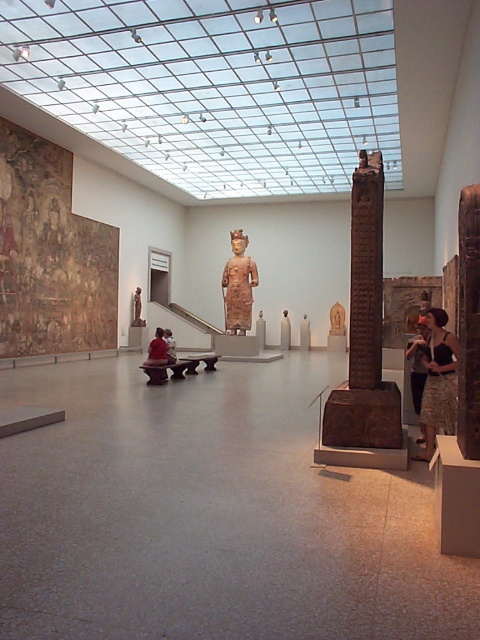
You are an art student visiting the museum and want to take a photo of the brown stone pillar at center without any obstructions. However, there is a black textured skirt at lower right in the way. Can you move around the pillar to get an unobstructed view?

The black textured skirt at lower right is behind the brown stone pillar at center, so if you move around to the front side of the brown stone pillar at center, you can take a photo without the skirt obstructing the view.

You are a tour guide leading a group through the museum. You want to ensure that visitors can comfortably walk between the brown stone pillar at center and the matte black statue at center. The average person requires 70 centimeters of space to move comfortably. Is the space between them sufficient?

The distance between the brown stone pillar at center and the matte black statue at center is 88.88 centimeters, which is more than the required 70 centimeters. Therefore, the space is sufficient for visitors to move comfortably between them.